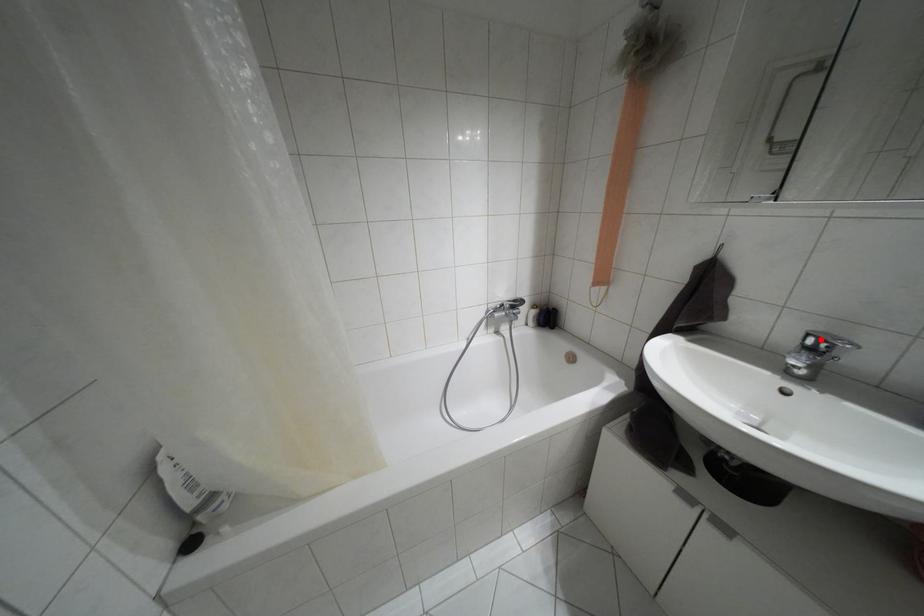
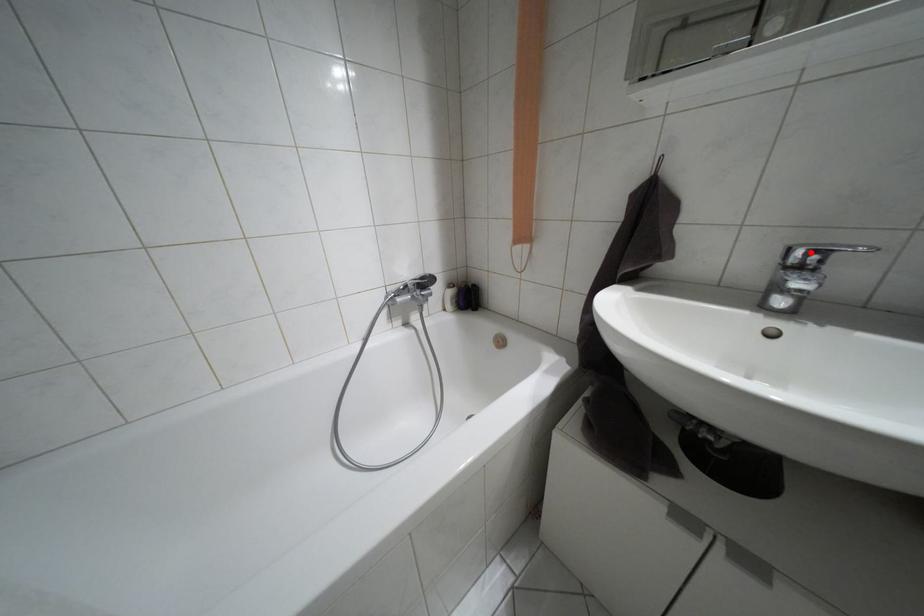
I am providing you with two images of the same scene from different viewpoints. A red point is marked on the first image and another point is marked on the second image. Do the highlighted points in image1 and image2 indicate the same real-world spot?

Yes